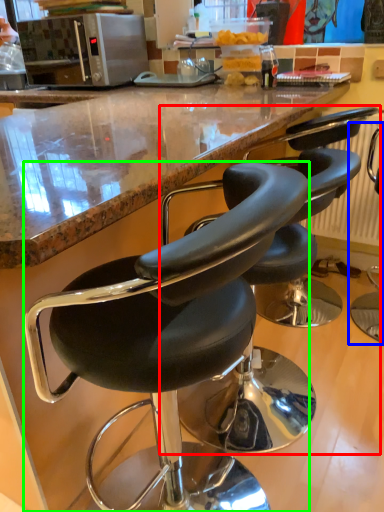
Question: Which is farther away from chair (highlighted by a red box)? chair (highlighted by a blue box) or chair (highlighted by a green box)?

Choices:
 (A) chair
 (B) chair

Answer: (A)